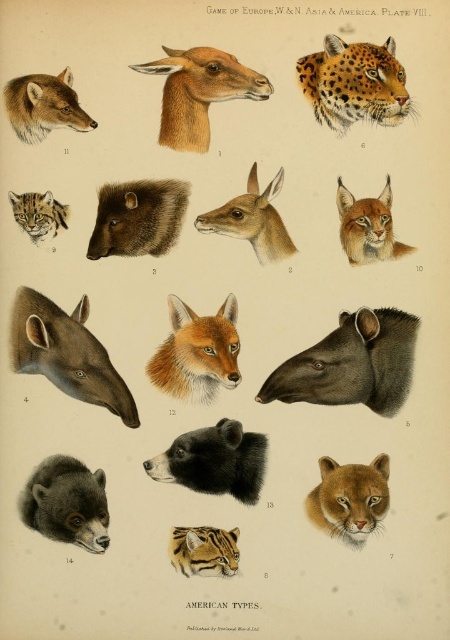
Based on the scene described, where is the black fur bear at center located in terms of coordinates?

The black fur bear at center is located at coordinates point (215, 460).